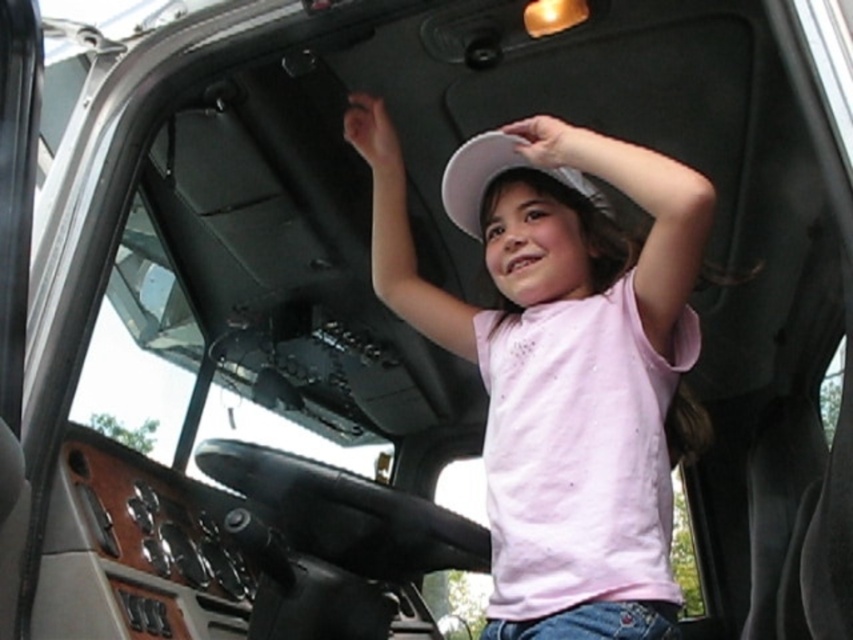
The white matte hat at upper center is represented by point (x=543, y=236). Is this point located in the upper half of the image?

Yes, the white matte hat at upper center is located at point (x=543, y=236), which is in the upper half of the image since the y coordinate is 0.638, greater than 0.5.

You are a pilot checking the cockpit for safety before takeoff. You notice two white matte hats inside the cockpit. According to the cockpit layout, which white matte hat is closer to you, the white matte hat at upper center or the white matte hat at center?

The white matte hat at upper center is closer to you because it is positioned in front of the white matte hat at center.

You are a flight attendant checking the cockpit for safety. You notice two white matte hats in the cockpit. How far apart are the white matte hat at upper center and the white matte hat at center?

The white matte hat at upper center and the white matte hat at center are 16.64 centimeters apart from each other.